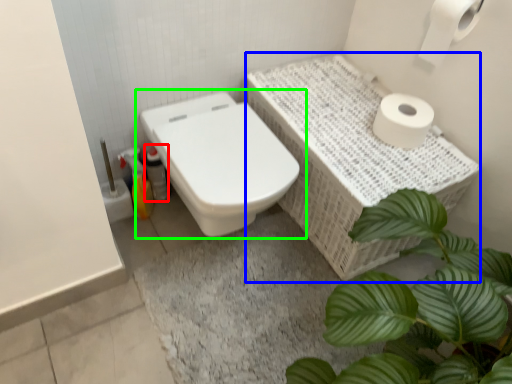
Question: Considering the real-world distances, which object is farthest from bottle (highlighted by a red box)? counter top (highlighted by a blue box) or toilet (highlighted by a green box)?

Choices:
 (A) counter top
 (B) toilet

Answer: (A)